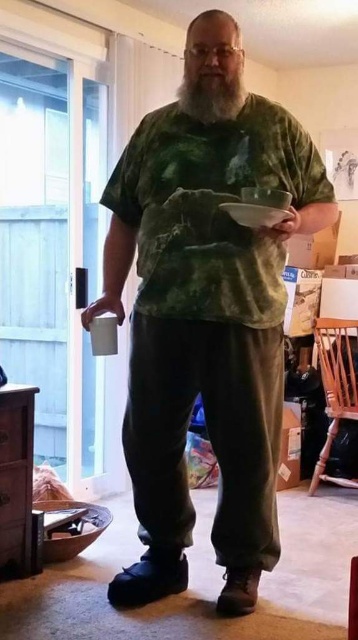
Question: Which point is closer to the camera taking this photo?

Choices:
 (A) (296, 221)
 (B) (191, 113)
 (C) (262, 208)
 (D) (21, 458)

Answer: (C)

Question: From the image, what is the correct spatial relationship of matte green plate at upper center in relation to matte green plate at center?

Choices:
 (A) right
 (B) left

Answer: (B)

Question: Estimate the real-world distances between objects in this image. Which object is closer to the matte green plate at center?

Choices:
 (A) white soft beard at center
 (B) matte green plate at upper center
 (C) matte green tie-dye shirt at center

Answer: (B)

Question: From the image, what is the correct spatial relationship of white soft beard at center in relation to matte green plate at upper center?

Choices:
 (A) below
 (B) above

Answer: (B)

Question: Which point is closer to the camera taking this photo?

Choices:
 (A) (139, 372)
 (B) (5, 500)
 (C) (268, 221)

Answer: (C)

Question: Does matte green tie-dye shirt at center appear under matte white cup at lower left?

Choices:
 (A) yes
 (B) no

Answer: (A)